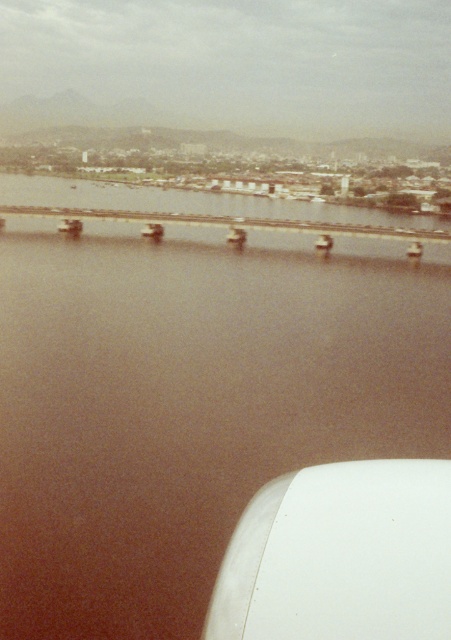
Question: Does brown water at center come in front of concrete bridge at center?

Choices:
 (A) yes
 (B) no

Answer: (A)

Question: Which point is closer to the camera taking this photo?

Choices:
 (A) (19, 488)
 (B) (396, 253)

Answer: (A)

Question: Can you confirm if brown water at center is positioned below concrete bridge at center?

Choices:
 (A) yes
 (B) no

Answer: (A)

Question: Considering the relative positions of brown water at center and concrete bridge at center in the image provided, where is brown water at center located with respect to concrete bridge at center?

Choices:
 (A) right
 (B) left

Answer: (B)

Question: Which point is closer to the camera?

Choices:
 (A) concrete bridge at center
 (B) brown water at center

Answer: (B)